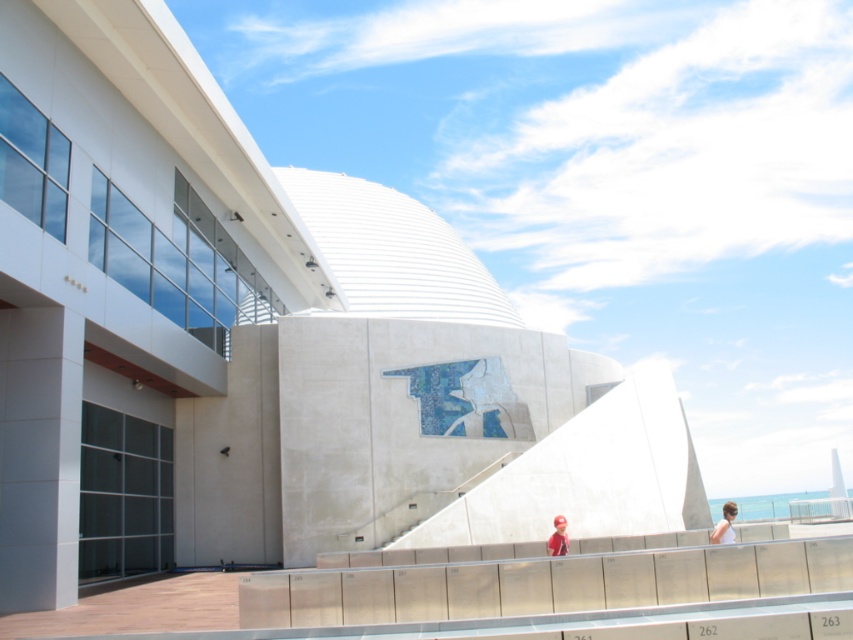
You are standing in front of a modern building with a dome and a mosaic artwork. You are wearing a white matte shirt at lower right. If you want to take a photo of the building without your shirt appearing in the frame, what should you do?

Since the white matte shirt at lower right is 17.42 meters away from the viewer, you can step back further to increase the distance between yourself and the building, ensuring the shirt is out of the camera frame.

You are an observer standing in front of the modern architectural structure. You notice a white matte shirt at lower right and a red cap at lower center. Which object is taller?

The white matte shirt at lower right is taller than the red cap at lower center.